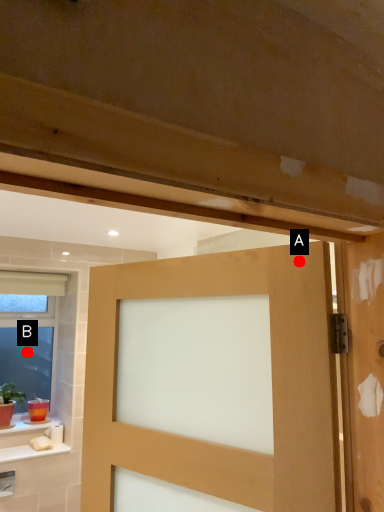
Question: Two points are circled on the image, labeled by A and B beside each circle. Which of the following is the closest to the observer?

Choices:
 (A) A is closer
 (B) B is closer

Answer: (A)